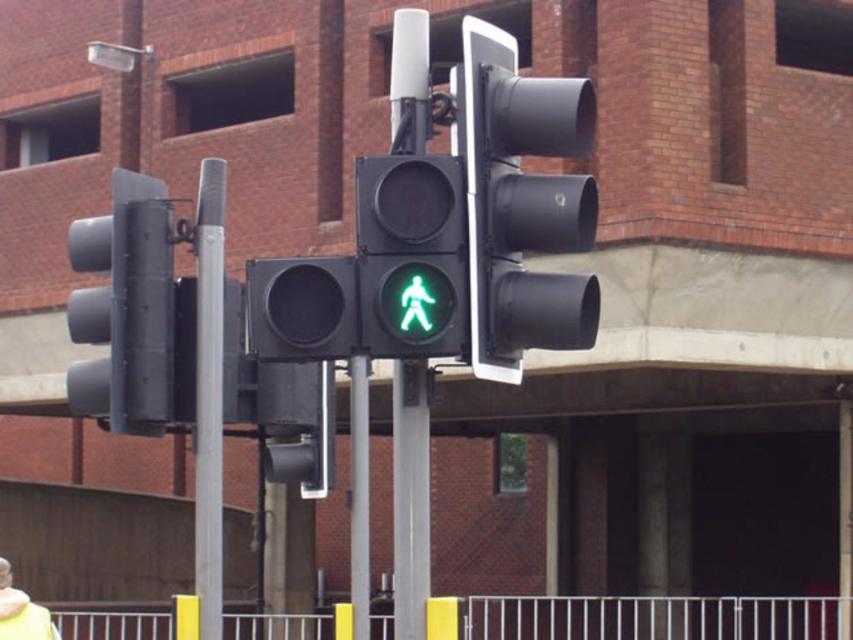
You are a pedestrian standing at the crosswalk and see the silver metallic pole at left and the yellow woolen jacket at lower left. Which object is bigger in size?

The silver metallic pole at left has a larger size compared to the yellow woolen jacket at lower left.

Based on the photo, you are a city planner assessing the placement of traffic lights and pedestrian signals. Given the scene described, can you determine if the matte black traffic light at left is wider than the green matte pedestrian signal at center?

The matte black traffic light at left might be wider than green matte pedestrian signal at center according to the description.

You are a delivery person with a 36 inch wide cart. You need to pass between the matte black traffic light at left and the silver metallic pole at left to reach the sidewalk. Will your cart fit through the space between them?

The distance between the matte black traffic light at left and the silver metallic pole at left is 33.60 inches. Since your cart is 36 inches wide, it is wider than the available space. Your cart will not fit through the space between them.